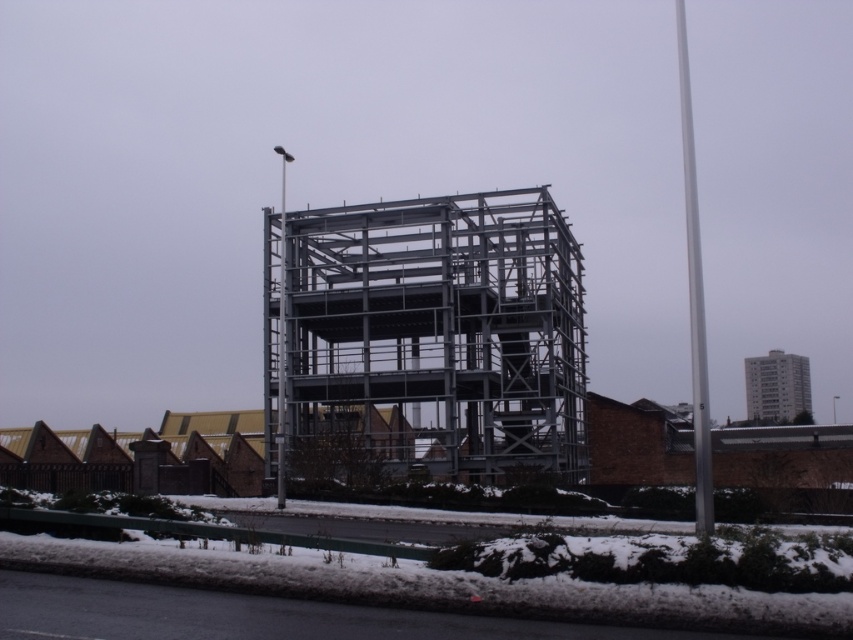
Can you confirm if metallic structure at center is smaller than gray concrete building at upper right?

Actually, metallic structure at center might be larger than gray concrete building at upper right.

The image size is (853, 640). In order to click on metallic structure at center in this screenshot , I will do `click(427, 340)`.

I want to click on metallic structure at center, so click(427, 340).

Between gray concrete building at upper right and metallic gray pole at center, which one appears on the left side from the viewer's perspective?

metallic gray pole at center

Locate an element on the screen. gray concrete building at upper right is located at coordinates (776, 387).

This screenshot has width=853, height=640. Find the location of `gray concrete building at upper right`. gray concrete building at upper right is located at coordinates (776, 387).

Where is `gray concrete building at upper right`? This screenshot has width=853, height=640. gray concrete building at upper right is located at coordinates (776, 387).

Is point (566, 301) farther from camera compared to point (279, 476)?

That is True.

Is metallic structure at center bigger than metallic gray pole at center?

No.

Is point (306, 428) closer to camera compared to point (282, 330)?

No, it is behind (282, 330).

Locate an element on the screen. The width and height of the screenshot is (853, 640). metallic structure at center is located at coordinates (427, 340).